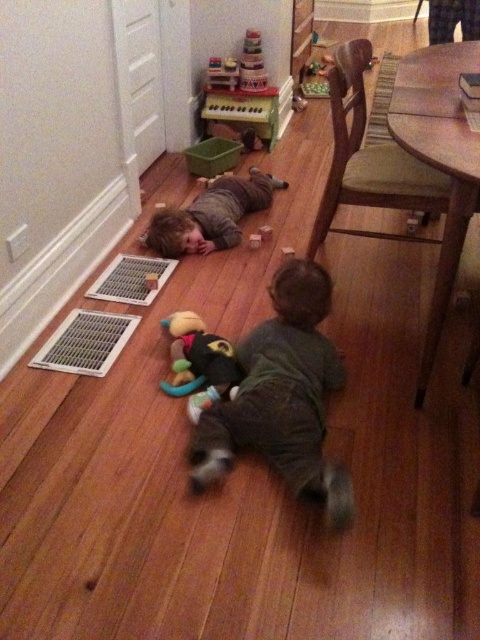
You are standing at the origin point of the room. Where is the dark gray soft toddler at center located in terms of coordinates?

The dark gray soft toddler at center is located at coordinates point [282,396].

You are a parent trying to locate your children in the living room. You see the dark gray soft toddler at center and the matte gray shirt at center. Which child is closer to you?

The dark gray soft toddler at center is closer to you because it is in front of the matte gray shirt at center.

You are a parent looking at the scene and want to pick up the dark gray soft toddler at center and the soft plush toy at center. Which one will you need to reach further to pick up?

Result: The soft plush toy at center requires reaching further because it is farther from the viewer compared to the dark gray soft toddler at center.